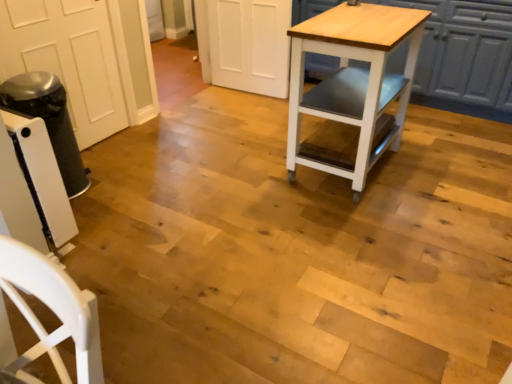
Question: Is light wood/matte table at center closer to camera compared to white wood cabinet at upper right?

Choices:
 (A) no
 (B) yes

Answer: (B)

Question: Could you tell me if light wood/matte table at center is facing white wood cabinet at upper right?

Choices:
 (A) yes
 (B) no

Answer: (B)

Question: Does light wood/matte table at center come behind white wood cabinet at upper right?

Choices:
 (A) yes
 (B) no

Answer: (B)

Question: Is light wood/matte table at center to the left of white wood cabinet at upper right from the viewer's perspective?

Choices:
 (A) no
 (B) yes

Answer: (B)

Question: Can you confirm if light wood/matte table at center is bigger than white wood cabinet at upper right?

Choices:
 (A) no
 (B) yes

Answer: (A)

Question: Is light wood/matte table at center far from white wood cabinet at upper right?

Choices:
 (A) no
 (B) yes

Answer: (A)

Question: Is white wood cabinet at upper right positioned with its back to light wood/matte table at center?

Choices:
 (A) yes
 (B) no

Answer: (B)

Question: Is white wood cabinet at upper right not inside light wood/matte table at center?

Choices:
 (A) yes
 (B) no

Answer: (A)

Question: From a real-world perspective, is white wood cabinet at upper right physically above light wood/matte table at center?

Choices:
 (A) yes
 (B) no

Answer: (B)

Question: Considering the relative sizes of white wood cabinet at upper right and light wood/matte table at center in the image provided, is white wood cabinet at upper right bigger than light wood/matte table at center?

Choices:
 (A) yes
 (B) no

Answer: (A)

Question: Is white wood cabinet at upper right facing towards light wood/matte table at center?

Choices:
 (A) no
 (B) yes

Answer: (B)

Question: Is white wood cabinet at upper right next to light wood/matte table at center?

Choices:
 (A) yes
 (B) no

Answer: (B)

Question: In terms of width, does light wood/matte table at center look wider or thinner when compared to white wood cabinet at upper right?

Choices:
 (A) thin
 (B) wide

Answer: (A)